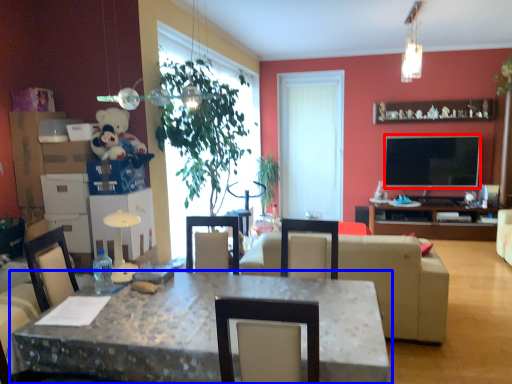
Question: Which of the following is the closest to the observer, television (highlighted by a red box) or desk (highlighted by a blue box)?

Choices:
 (A) television
 (B) desk

Answer: (B)